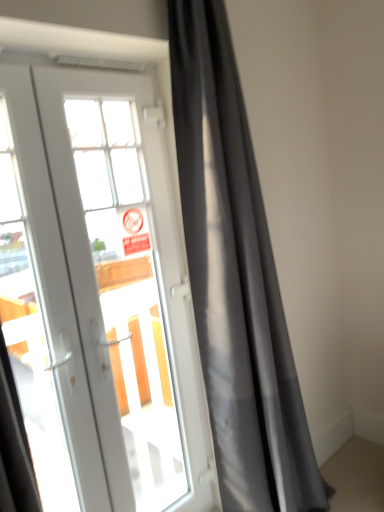
Question: Does white glass door at center have a lesser height compared to matte gray curtain at center?

Choices:
 (A) yes
 (B) no

Answer: (A)

Question: Are white glass door at center and matte gray curtain at center making contact?

Choices:
 (A) no
 (B) yes

Answer: (A)

Question: Does white glass door at center appear on the right side of matte gray curtain at center?

Choices:
 (A) no
 (B) yes

Answer: (A)

Question: Is matte gray curtain at center surrounded by white glass door at center?

Choices:
 (A) yes
 (B) no

Answer: (B)

Question: Does white glass door at center appear on the left side of matte gray curtain at center?

Choices:
 (A) yes
 (B) no

Answer: (A)

Question: From the image's perspective, is white glass door at center above matte gray curtain at center?

Choices:
 (A) yes
 (B) no

Answer: (B)

Question: Considering the relative sizes of matte gray curtain at center and white glass door at center in the image provided, is matte gray curtain at center smaller than white glass door at center?

Choices:
 (A) yes
 (B) no

Answer: (B)

Question: Is the position of matte gray curtain at center less distant than that of white glass door at center?

Choices:
 (A) no
 (B) yes

Answer: (A)

Question: Considering the relative sizes of matte gray curtain at center and white glass door at center in the image provided, is matte gray curtain at center bigger than white glass door at center?

Choices:
 (A) no
 (B) yes

Answer: (B)

Question: From the image's perspective, is matte gray curtain at center under white glass door at center?

Choices:
 (A) yes
 (B) no

Answer: (B)

Question: Would you say matte gray curtain at center is a long distance from white glass door at center?

Choices:
 (A) no
 (B) yes

Answer: (A)

Question: Can you confirm if matte gray curtain at center is shorter than white glass door at center?

Choices:
 (A) yes
 (B) no

Answer: (B)

Question: Looking at the image, does matte gray curtain at center seem bigger or smaller compared to white glass door at center?

Choices:
 (A) small
 (B) big

Answer: (B)